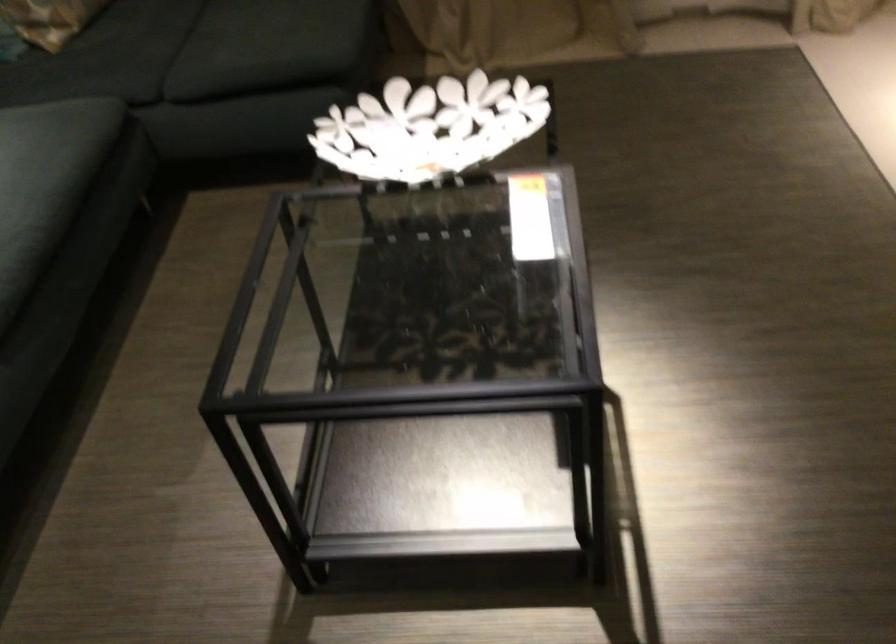
Locate an element on the screen. The image size is (896, 644). sofa sitting surface is located at coordinates (85, 73).